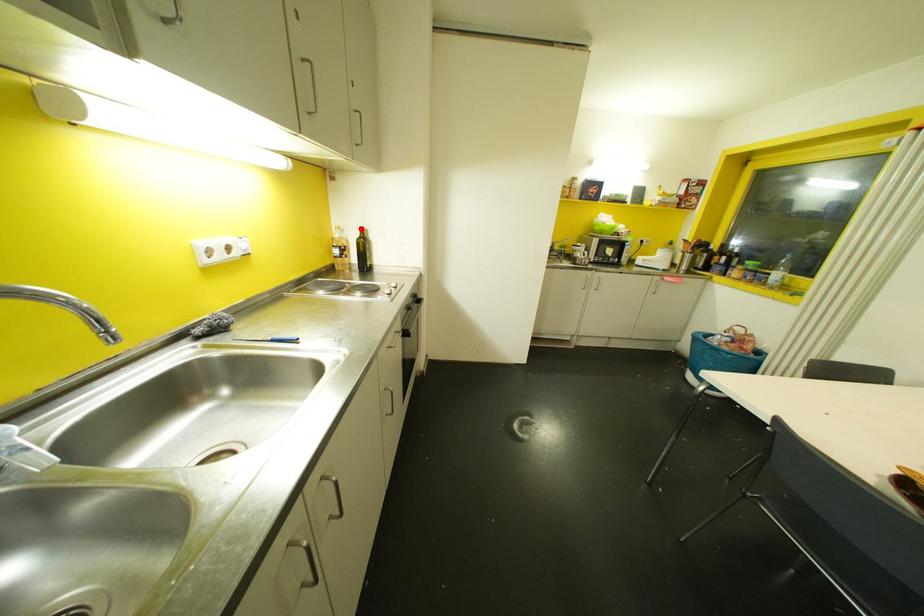
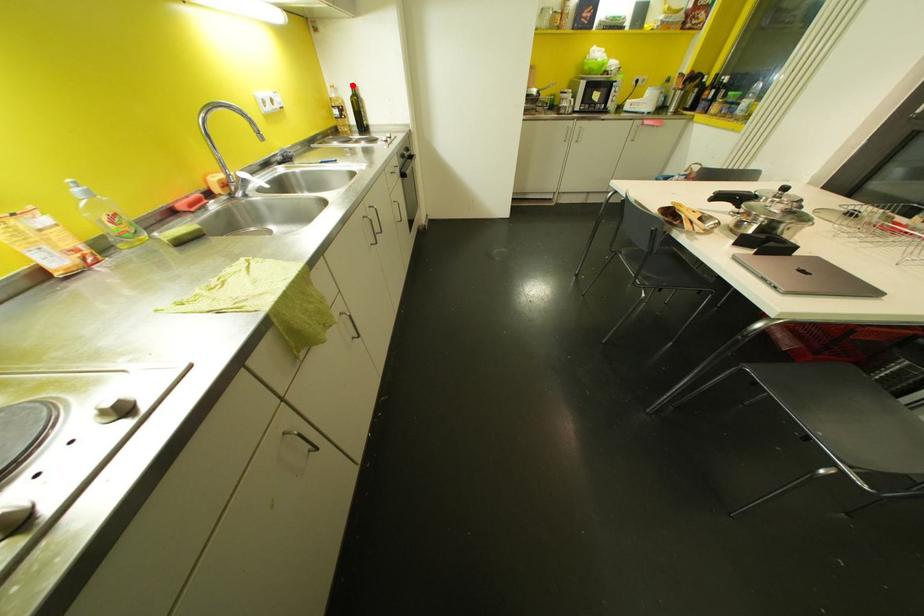
I am providing you with two images of the same scene from different viewpoints. A red point is marked on the first image and another point is marked on the second image. Is the marked point in image1 the same physical position as the marked point in image2?

Yes